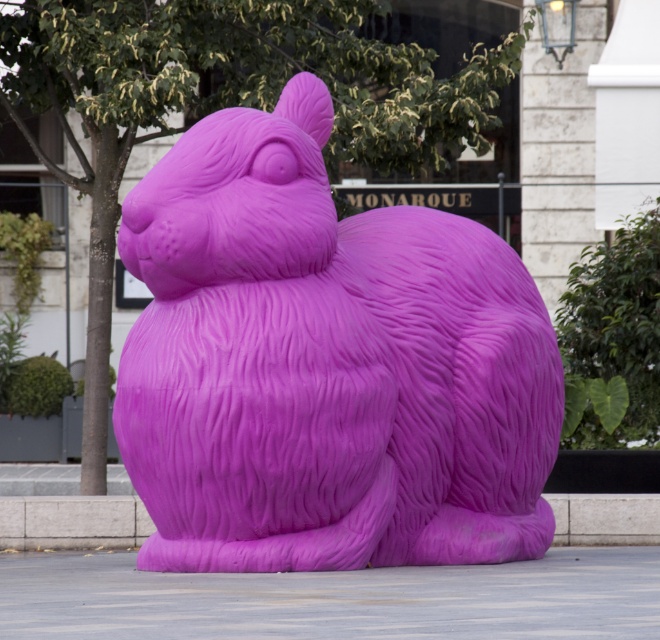
Image resolution: width=660 pixels, height=640 pixels. I want to click on matte purple rabbit at center, so click(x=325, y=365).

Find the location of a particular element. This screenshot has width=660, height=640. matte purple rabbit at center is located at coordinates (325, 365).

Image resolution: width=660 pixels, height=640 pixels. Find the location of `matte purple rabbit at center`. matte purple rabbit at center is located at coordinates (325, 365).

Between gray concrete pavement at center and purple rubber curb at lower center, which one appears on the right side from the viewer's perspective?

gray concrete pavement at center is more to the right.

Locate an element on the screen. gray concrete pavement at center is located at coordinates (335, 598).

Between matte purple rabbit at center and purple rubber curb at lower center, which one is positioned higher?

matte purple rabbit at center is higher up.

This screenshot has height=640, width=660. Identify the location of matte purple rabbit at center. (325, 365).